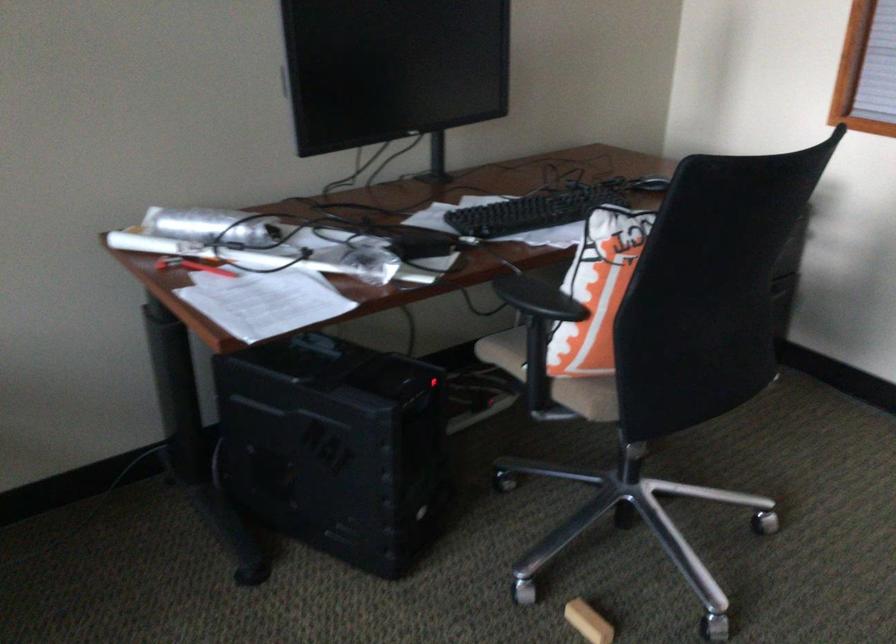
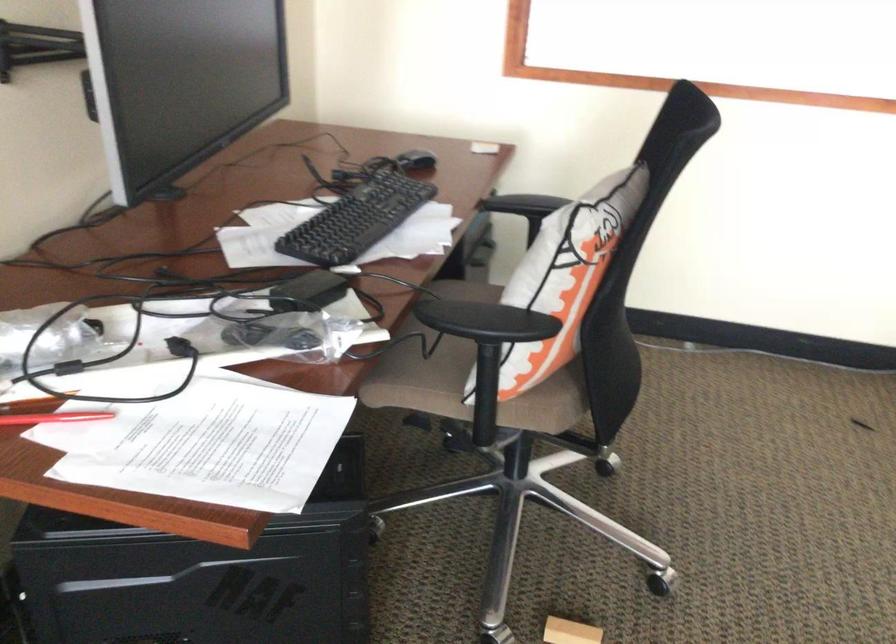
Locate, in the second image, the point that corresponds to (520,210) in the first image.

(356, 220)